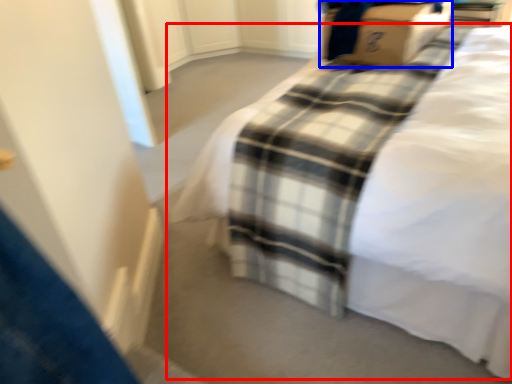
Question: Which object appears closest to the camera in this image, bed (highlighted by a red box) or cardboard box (highlighted by a blue box)?

Choices:
 (A) bed
 (B) cardboard box

Answer: (A)